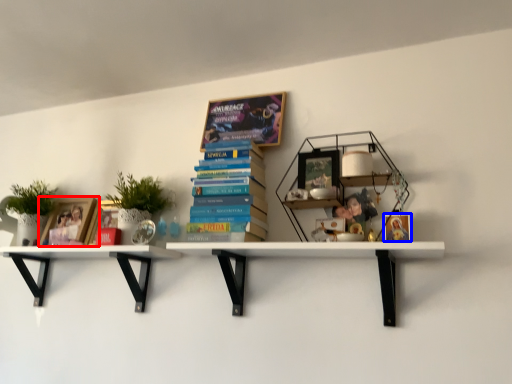
Question: Among these objects, which one is farthest to the camera, book cover (highlighted by a red box) or book cover (highlighted by a blue box)?

Choices:
 (A) book cover
 (B) book cover

Answer: (A)